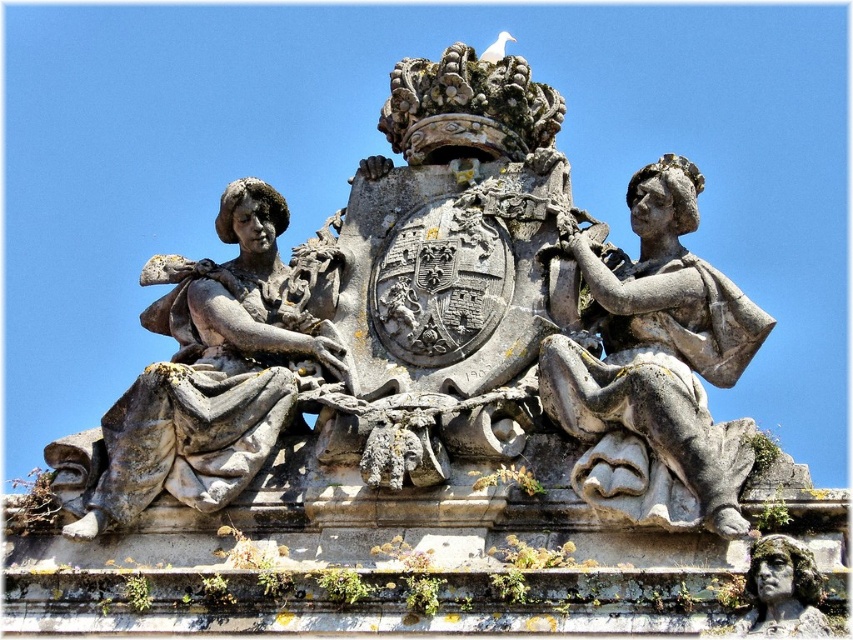
Question: Does gray stone sculpture at center have a greater width compared to gray stone statue at center?

Choices:
 (A) yes
 (B) no

Answer: (A)

Question: Among these points, which one is farthest from the camera?

Choices:
 (A) (680, 189)
 (B) (467, 192)

Answer: (B)

Question: Which point is closer to the camera?

Choices:
 (A) gray stone sculpture at center
 (B) gray stone statue at center

Answer: (B)

Question: Which point is farther to the camera?

Choices:
 (A) stone statue at left
 (B) gray stone statue at center
 (C) gray stone sculpture at center

Answer: (A)

Question: Does gray stone sculpture at center appear under gray stone statue at center?

Choices:
 (A) yes
 (B) no

Answer: (B)

Question: Is gray stone sculpture at center bigger than stone statue at left?

Choices:
 (A) no
 (B) yes

Answer: (B)